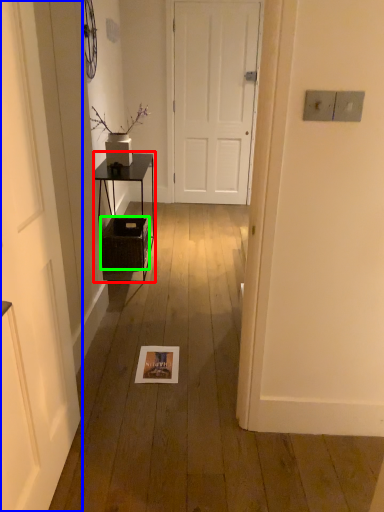
Question: Which object is the farthest from table (highlighted by a red box)? Choose among these: door (highlighted by a blue box) or crate (highlighted by a green box).

Choices:
 (A) door
 (B) crate

Answer: (A)